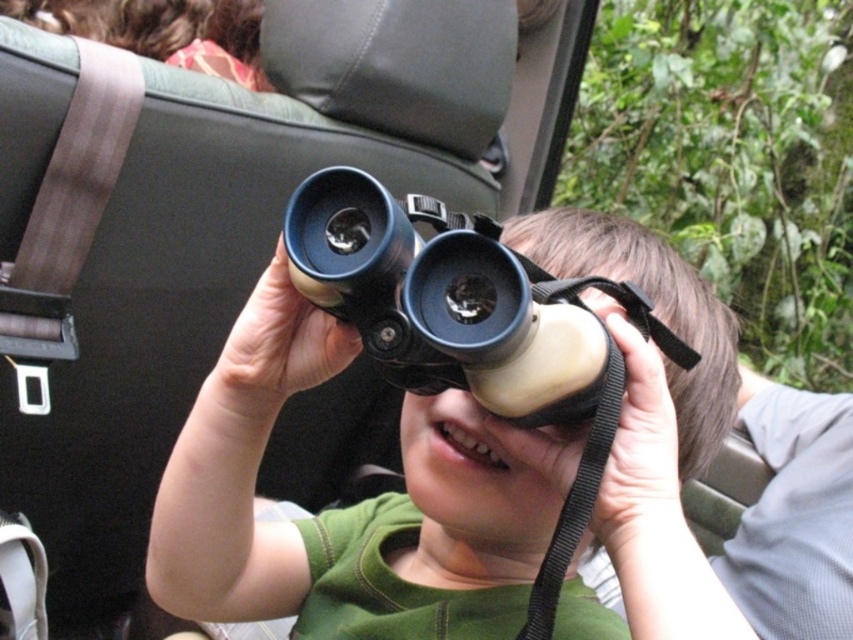
Where is `matte black binoculars at center`? The height and width of the screenshot is (640, 853). matte black binoculars at center is located at coordinates (653, 420).

In the scene shown: Which is more to the right, matte black binoculars at center or black rubber binoculars at center?

Positioned to the right is black rubber binoculars at center.

I want to click on matte black binoculars at center, so click(653, 420).